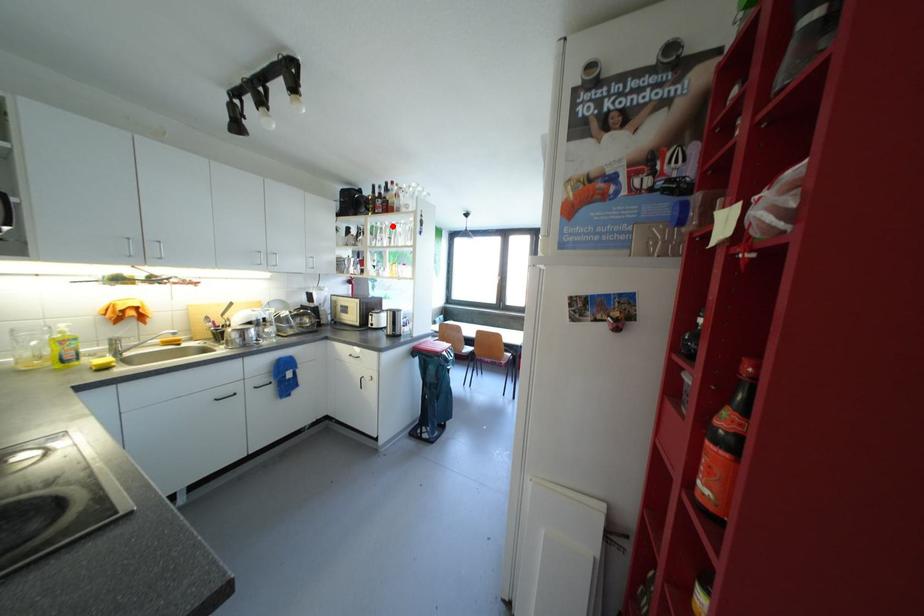
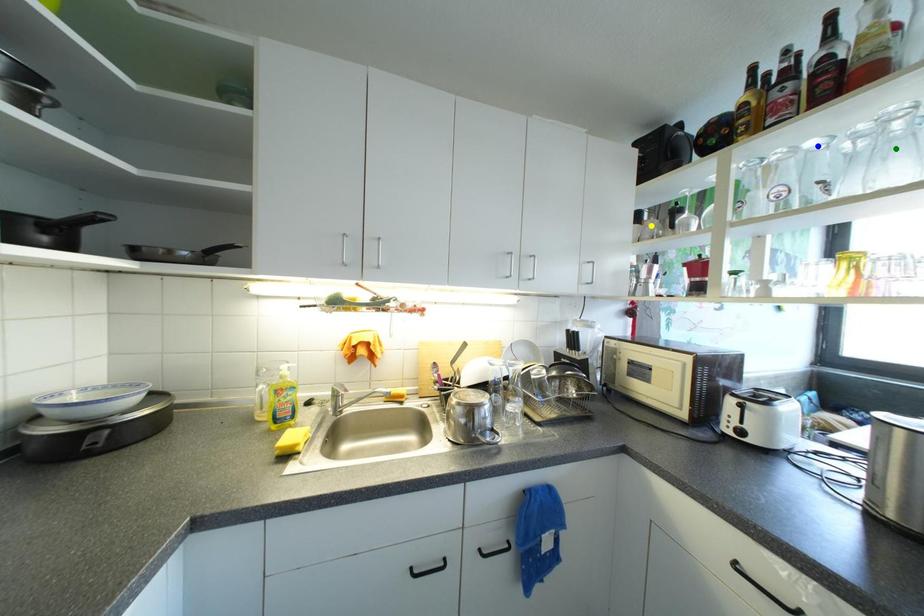
Question: I am providing you with two images of the same scene from different viewpoints. A red point is marked on the first image. You are given multiple points on the second image. In image 2, which mark is for the same physical point as the one in image 1?

Choices:
 (A) green point
 (B) yellow point
 (C) blue point

Answer: (C)